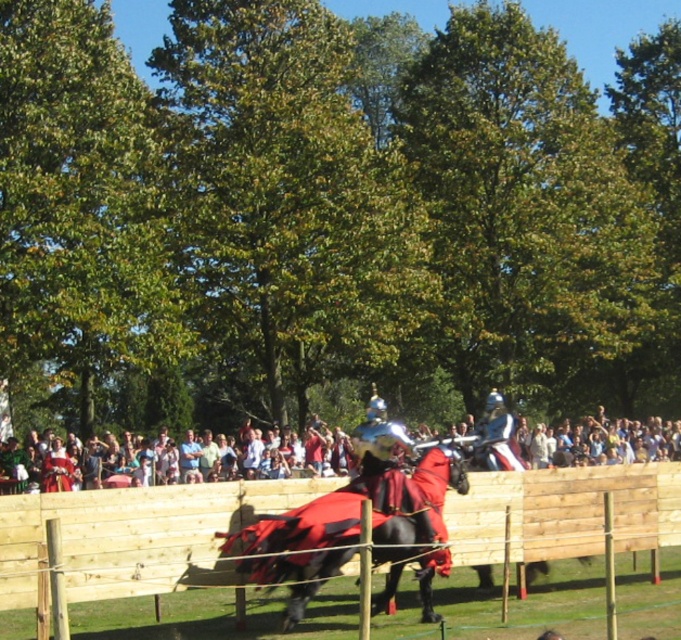
You are a medieval knight preparing to joust. You notice two items at the center of the arena. Which item is thinner between the wooden at center and the white cotton shirt at center?

The wooden at center is thinner than the white cotton shirt at center according to the description.

You are a spectator at the medieval event and want to take a photo of the two points mentioned. Which point, point (509, 444) or point (349, 483), is closer to you?

Point (349, 483) is closer to you because point (509, 444) is behind it.